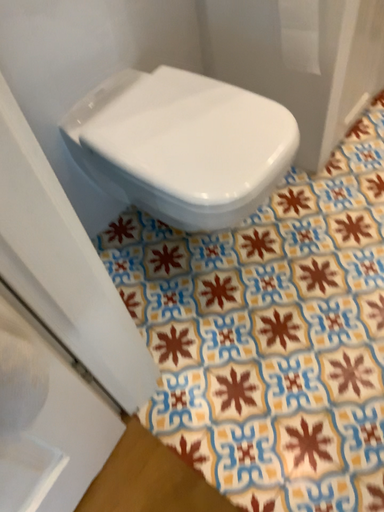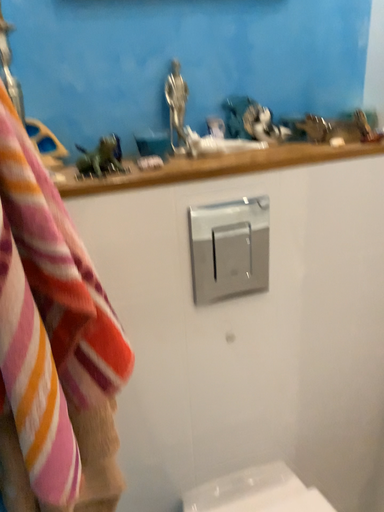
Question: How did the camera likely rotate when shooting the video?

Choices:
 (A) rotated right
 (B) rotated left

Answer: (B)